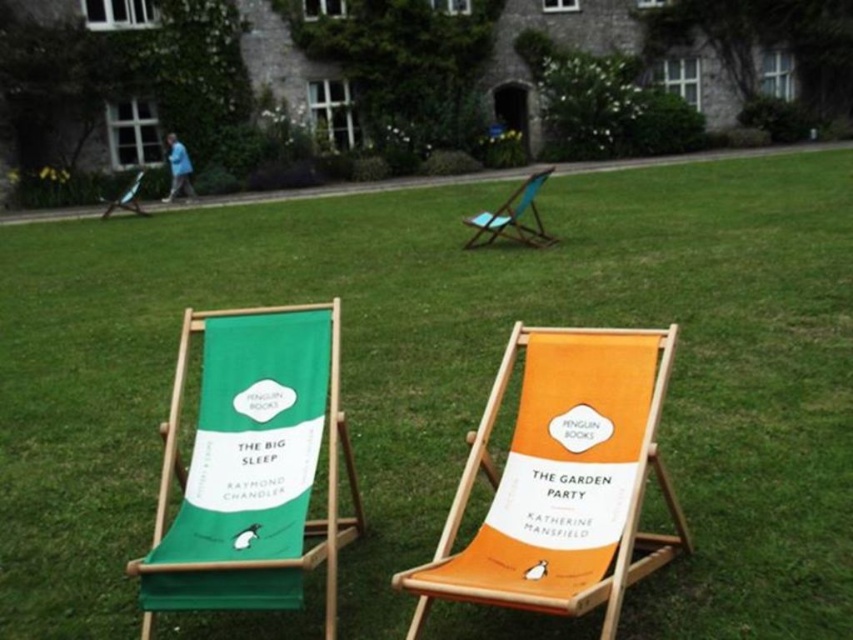
Question: Is green fabric beach chair at left positioned before teal fabric chair at upper center?

Choices:
 (A) yes
 (B) no

Answer: (A)

Question: Can you confirm if green fabric beach chair at left is positioned above matte green deck chair at center?

Choices:
 (A) yes
 (B) no

Answer: (B)

Question: Which of the following is the farthest from the observer?

Choices:
 (A) orange fabric beach chair at center
 (B) green fabric beach chair at left
 (C) matte green deck chair at center

Answer: (C)

Question: Which is farther from the matte green deck chair at center?

Choices:
 (A) orange fabric beach chair at center
 (B) green fabric beach chair at left

Answer: (A)

Question: Estimate the real-world distances between objects in this image. Which object is closer to the orange fabric beach chair at center?

Choices:
 (A) matte green deck chair at center
 (B) green fabric beach chair at left
 (C) teal fabric chair at upper center

Answer: (B)

Question: Can you confirm if orange fabric beach chair at center is thinner than matte green deck chair at center?

Choices:
 (A) yes
 (B) no

Answer: (A)